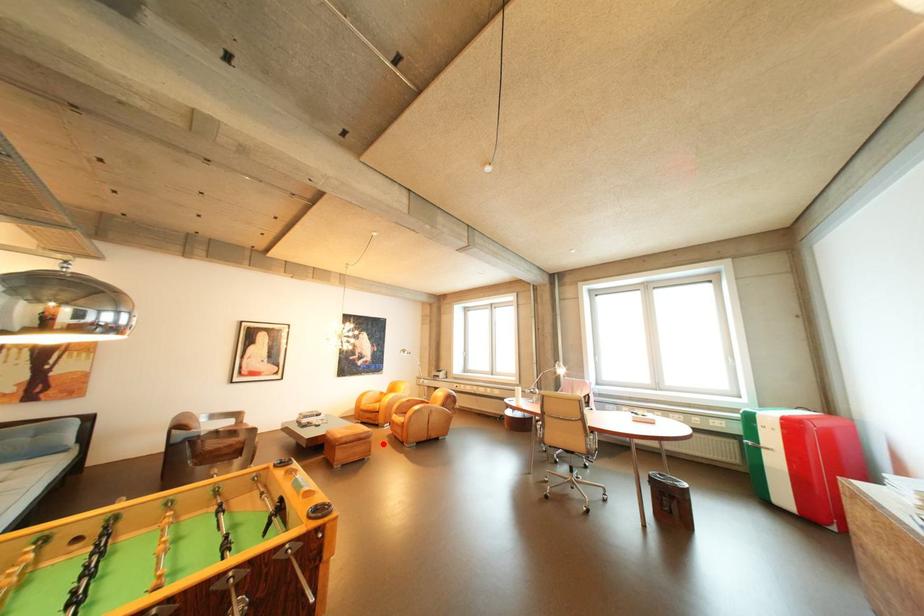
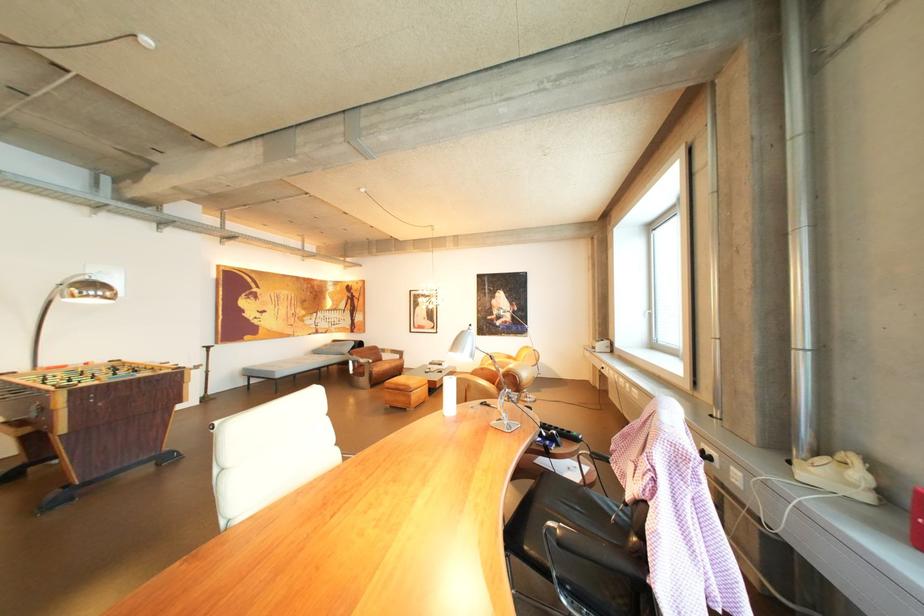
Question: I am providing you with two images of the same scene from different viewpoints. Given a red point in image1, look at the same physical point in image2. Is it:

Choices:
 (A) Closer to the viewpoint
 (B) Farther from the viewpoint

Answer: (A)